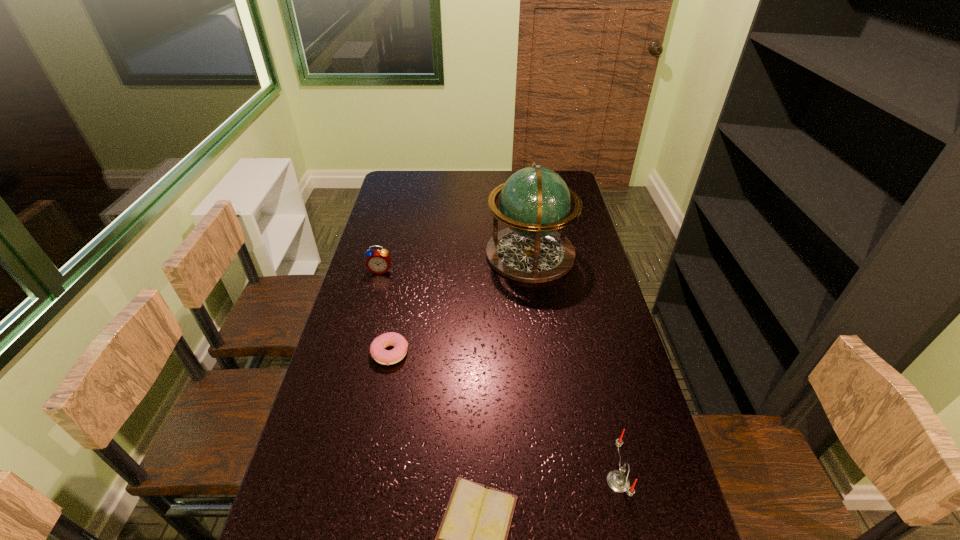
Where is `free area in between the alarm clock and the third farthest object`? This screenshot has width=960, height=540. free area in between the alarm clock and the third farthest object is located at coordinates (385, 312).

Where is `vacant area that lies between the candle and the alarm clock`? vacant area that lies between the candle and the alarm clock is located at coordinates (499, 376).

Locate an element on the screen. This screenshot has width=960, height=540. free space between the alarm clock and the third farthest object is located at coordinates (385, 312).

Where is `free space between the third farthest object and the candle`? The height and width of the screenshot is (540, 960). free space between the third farthest object and the candle is located at coordinates (504, 417).

I want to click on vacant area that lies between the alarm clock and the doughnut, so [x=385, y=312].

At what (x,y) coordinates should I click in order to perform the action: click on object that is the second closest to the doughnut. Please return your answer as a coordinate pair (x, y). The image size is (960, 540). Looking at the image, I should click on (472, 538).

Locate which object is the third closest to the alarm clock. Please provide its 2D coordinates. Your answer should be formatted as a tuple, i.e. [(x, y)], where the tuple contains the x and y coordinates of a point satisfying the conditions above.

[(472, 538)]

Identify the location of vacant area that satisfies the following two spatial constraints: 1. on the front-facing side of the doughnut; 2. on the right side of the alarm clock. The image size is (960, 540). (359, 353).

Identify the location of vacant space that satisfies the following two spatial constraints: 1. on the front-facing side of the globe; 2. on the front-facing side of the alarm clock. (532, 270).

Image resolution: width=960 pixels, height=540 pixels. Find the location of `free location that satisfies the following two spatial constraints: 1. on the front-facing side of the third farthest object; 2. on the right side of the alarm clock`. free location that satisfies the following two spatial constraints: 1. on the front-facing side of the third farthest object; 2. on the right side of the alarm clock is located at coordinates (359, 353).